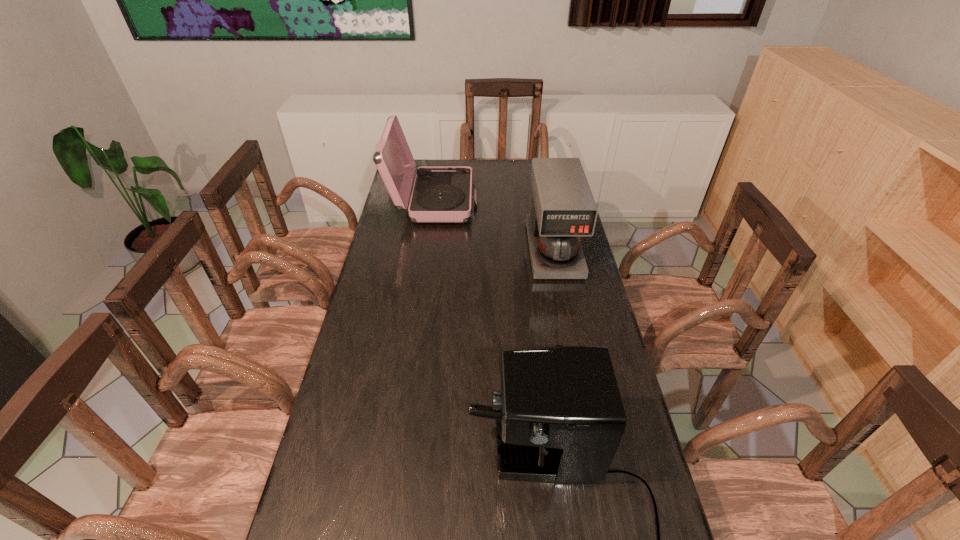
Locate an element on the screen. record player is located at coordinates click(x=441, y=194).

You are a GUI agent. You are given a task and a screenshot of the screen. Output one action in this format:
    pyautogui.click(x=<x>, y=<y>)
    Task: Click on the farther coffee maker
    
    Given the screenshot: What is the action you would take?
    pyautogui.click(x=563, y=208)

Where is `vacant space located with the lid open on the record player`? The image size is (960, 540). vacant space located with the lid open on the record player is located at coordinates (536, 202).

Image resolution: width=960 pixels, height=540 pixels. Find the location of `vacant position located 0.140m on the carafe side of the farther coffee maker`. vacant position located 0.140m on the carafe side of the farther coffee maker is located at coordinates (565, 311).

What are the coordinates of `object that is at the far edge` in the screenshot? It's located at (441, 194).

Find the location of a particular element. Image resolution: width=960 pixels, height=540 pixels. object that is at the left edge is located at coordinates (441, 194).

The width and height of the screenshot is (960, 540). Identify the location of object that is at the right edge. (563, 208).

You are a GUI agent. You are given a task and a screenshot of the screen. Output one action in this format:
    pyautogui.click(x=<x>, y=<y>)
    Task: Click on the object that is at the far left corner
    This screenshot has width=960, height=540.
    Given the screenshot: What is the action you would take?
    pyautogui.click(x=441, y=194)

Locate an element on the screen. This screenshot has height=540, width=960. vacant space at the far edge of the desktop is located at coordinates (508, 162).

You are a GUI agent. You are given a task and a screenshot of the screen. Output one action in this format:
    pyautogui.click(x=<x>, y=<y>)
    Task: Click on the free space at the left edge of the desktop
    The image size is (960, 540).
    Given the screenshot: What is the action you would take?
    pyautogui.click(x=388, y=283)